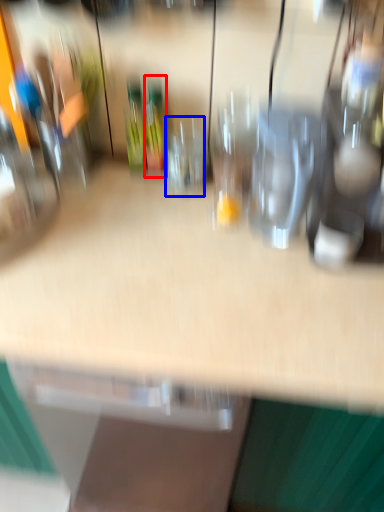
Question: Which point is further to the camera, wine bottle (highlighted by a red box) or wine glass (highlighted by a blue box)?

Choices:
 (A) wine bottle
 (B) wine glass

Answer: (A)